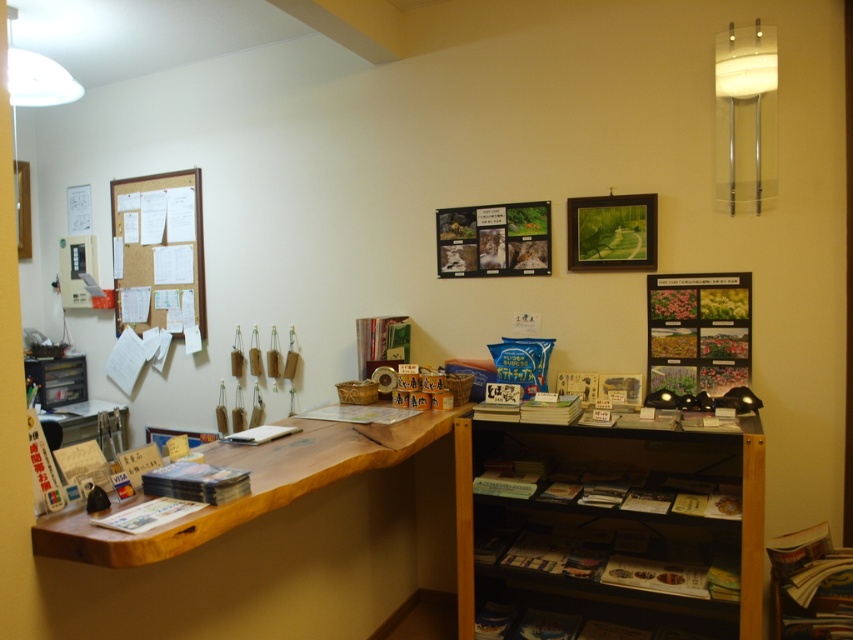
Can you confirm if wooden bookshelf at right is smaller than wooden picture frame at upper center?

Actually, wooden bookshelf at right might be larger than wooden picture frame at upper center.

Who is more distant from viewer, [619,545] or [576,259]?

The point [576,259] is more distant.

Is point (592, 508) positioned before point (653, 205)?

Yes, point (592, 508) is in front of point (653, 205).

The image size is (853, 640). What are the coordinates of `wooden bookshelf at right` in the screenshot? It's located at tap(610, 528).

Can you confirm if corkboard at upper left is positioned to the left of wooden picture frame at upper center?

Yes, corkboard at upper left is to the left of wooden picture frame at upper center.

In the scene shown: Between corkboard at upper left and wooden picture frame at upper center, which one has less height?

wooden picture frame at upper center

Who is more forward, (173,221) or (582,227)?

Positioned in front is point (582,227).

Locate an element on the screen. The image size is (853, 640). corkboard at upper left is located at coordinates (158, 241).

From the picture: Is corkboard at upper left taller than light blue paper at center?

Yes.

Does corkboard at upper left have a greater width compared to light blue paper at center?

Correct, the width of corkboard at upper left exceeds that of light blue paper at center.

Locate an element on the screen. This screenshot has width=853, height=640. corkboard at upper left is located at coordinates (158, 241).

You are a GUI agent. You are given a task and a screenshot of the screen. Output one action in this format:
    pyautogui.click(x=<x>, y=<y>)
    Task: Click on the corkboard at upper left
    This screenshot has height=640, width=853.
    Given the screenshot: What is the action you would take?
    pyautogui.click(x=158, y=241)